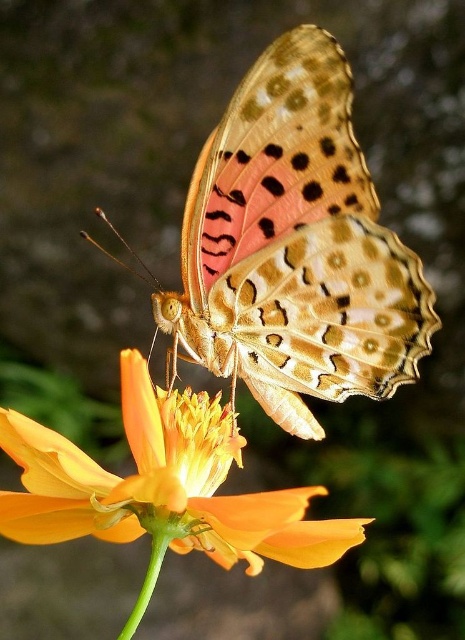
Does spotted orange butterfly at center appear under orange matte flower at center?

No, spotted orange butterfly at center is not below orange matte flower at center.

Who is shorter, spotted orange butterfly at center or orange matte flower at center?

With less height is orange matte flower at center.

The height and width of the screenshot is (640, 465). Identify the location of spotted orange butterfly at center. (293, 248).

What are the coordinates of `spotted orange butterfly at center` in the screenshot? It's located at (293, 248).